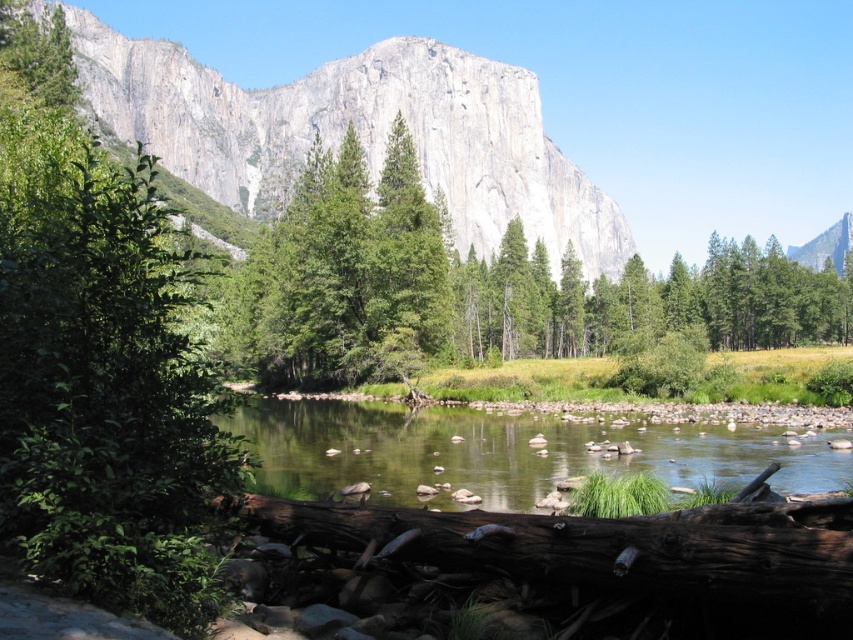
Question: Is green leafy tree at left to the right of clear water at center from the viewer's perspective?

Choices:
 (A) no
 (B) yes

Answer: (A)

Question: Which point is closer to the camera taking this photo?

Choices:
 (A) (154, 52)
 (B) (350, 460)
 (C) (39, 67)
 (D) (410, 168)

Answer: (B)

Question: Can you confirm if gray rock mountain at upper center is thinner than brown rough log at lower center?

Choices:
 (A) yes
 (B) no

Answer: (B)

Question: Which point is closer to the camera?

Choices:
 (A) brown rough log at lower center
 (B) gray rock mountain at upper center

Answer: (A)

Question: From the image, what is the correct spatial relationship of green leafy tree at left in relation to gray rock mountain at upper center?

Choices:
 (A) right
 (B) left

Answer: (B)

Question: Which object is positioned farthest from the green leafy tree at left?

Choices:
 (A) green matte tree at center
 (B) clear water at center
 (C) brown rough log at lower center
 (D) gray rock mountain at upper center

Answer: (D)